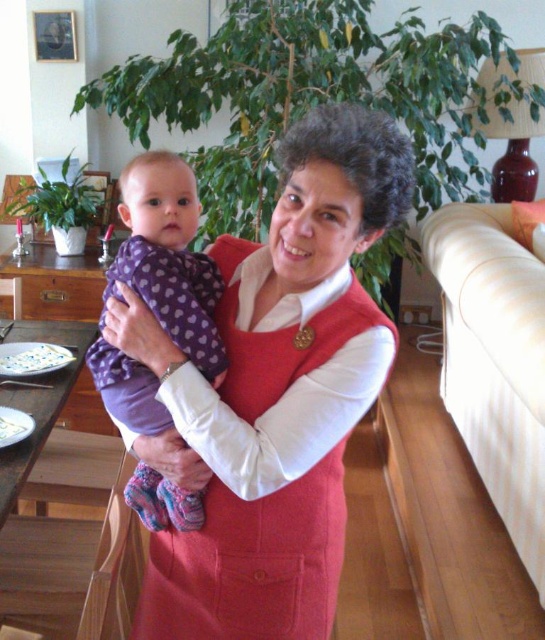
You are a photographer adjusting your camera to focus on the matte red dress at center and the purple fleece onesie at center. Which object should you adjust your focus to first if you want to capture both in sharp detail?

You should focus on the matte red dress at center first because it is closer to the viewer than the purple fleece onesie at center, so adjusting focus starting from the closer object ensures both can be in sharp detail.

You are a photographer trying to capture the perfect shot of the scene. The camera is positioned at the center of the image. To ensure the matte red dress at center is in focus, where should you adjust the focus point? Please provide coordinates in the format of a 2D point like x,y.

The matte red dress at center is located at the 2D coordinates point of [275,394]. Therefore, you should adjust the focus point to [275,394] to ensure it is in focus.